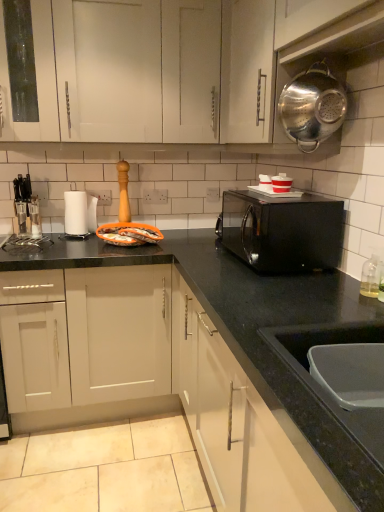
Question: Is polished stainless steel colander at upper right completely or partially outside of white glossy cup at upper center, which is the second appliance from left to right?

Choices:
 (A) no
 (B) yes

Answer: (B)

Question: Is the surface of polished stainless steel colander at upper right in direct contact with white glossy cup at upper center, marked as the first appliance in a right-to-left arrangement?

Choices:
 (A) no
 (B) yes

Answer: (A)

Question: Is polished stainless steel colander at upper right bigger than white glossy cup at upper center, the 2th appliance viewed from the back?

Choices:
 (A) yes
 (B) no

Answer: (A)

Question: From the image's perspective, is polished stainless steel colander at upper right on top of white glossy cup at upper center, the 2th appliance viewed from the back?

Choices:
 (A) no
 (B) yes

Answer: (B)

Question: Is polished stainless steel colander at upper right facing towards white glossy cup at upper center, the 2th appliance viewed from the back?

Choices:
 (A) yes
 (B) no

Answer: (B)

Question: Is polished stainless steel colander at upper right taller than white glossy cup at upper center, the 2th appliance viewed from the back?

Choices:
 (A) no
 (B) yes

Answer: (B)

Question: Are matte black knife block at left, the 2th appliance from the right, and metallic silver colander at upper right far apart?

Choices:
 (A) yes
 (B) no

Answer: (A)

Question: Is matte black knife block at left, the 2th appliance from the right, closer to camera compared to metallic silver colander at upper right?

Choices:
 (A) yes
 (B) no

Answer: (B)

Question: Considering the relative sizes of matte black knife block at left, the 1th appliance positioned from the back, and metallic silver colander at upper right in the image provided, is matte black knife block at left, the 1th appliance positioned from the back, shorter than metallic silver colander at upper right?

Choices:
 (A) no
 (B) yes

Answer: (B)

Question: From a real-world perspective, is matte black knife block at left, which appears as the 1th appliance when viewed from the left, physically above metallic silver colander at upper right?

Choices:
 (A) yes
 (B) no

Answer: (B)

Question: Does matte black knife block at left, the 2th appliance from the right, have a greater height compared to metallic silver colander at upper right?

Choices:
 (A) yes
 (B) no

Answer: (B)

Question: Is matte black knife block at left, the 1th appliance positioned from the back, oriented towards metallic silver colander at upper right?

Choices:
 (A) no
 (B) yes

Answer: (A)

Question: From a real-world perspective, is black glossy microwave at center over polished stainless steel colander at upper right?

Choices:
 (A) no
 (B) yes

Answer: (A)